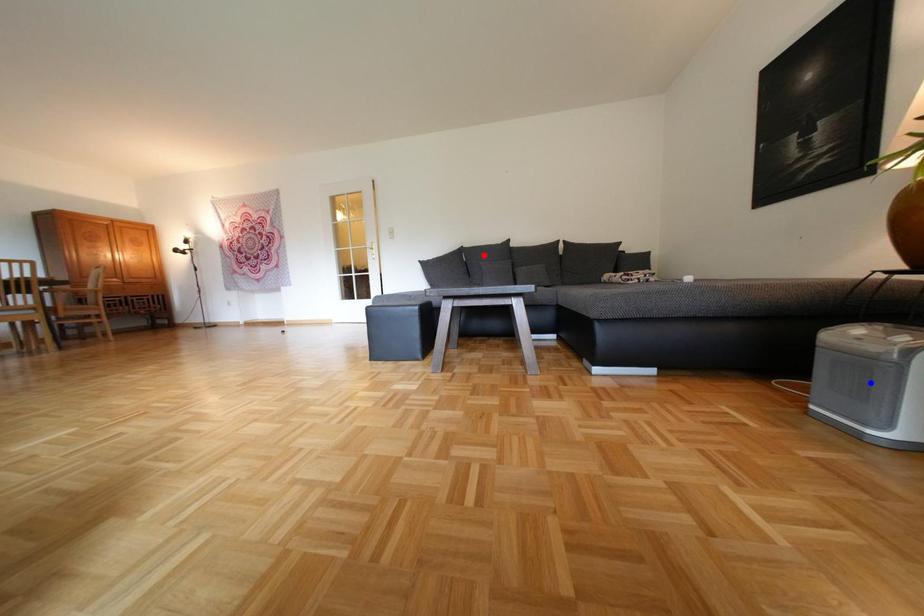
Question: Which of the two points in the image is closer to the camera?

Choices:
 (A) Blue point is closer.
 (B) Red point is closer.

Answer: (A)